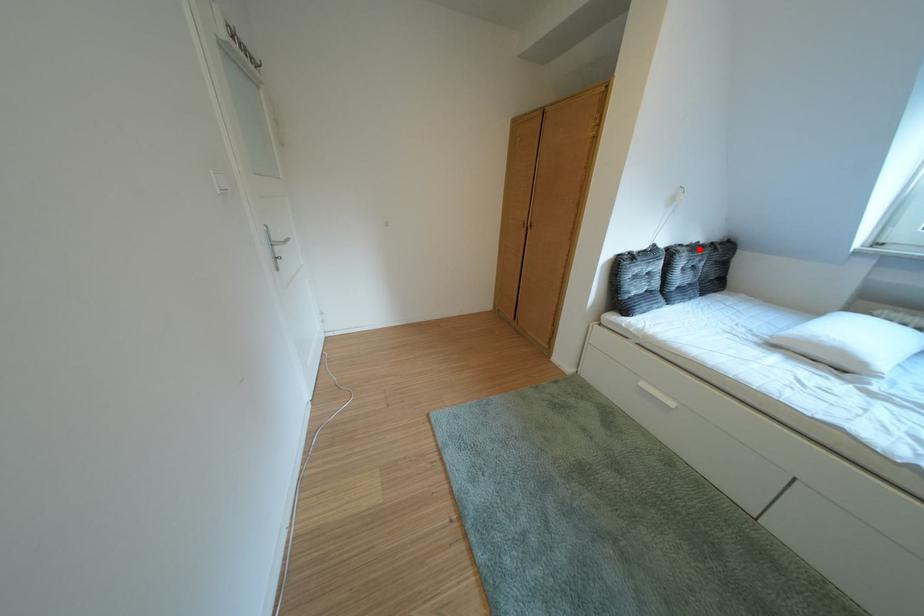
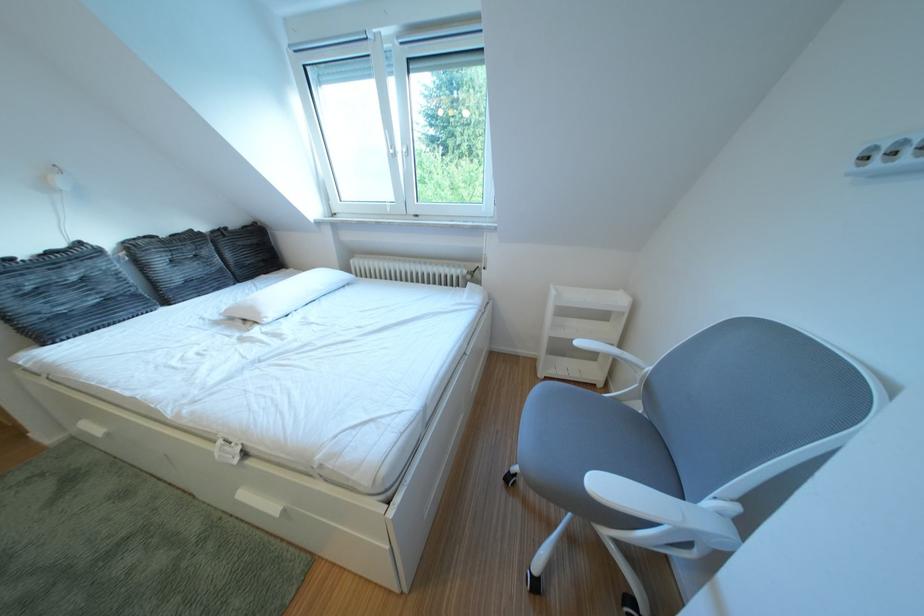
Where in the second image is the point corresponding to the highlighted location from the first image?

(176, 240)